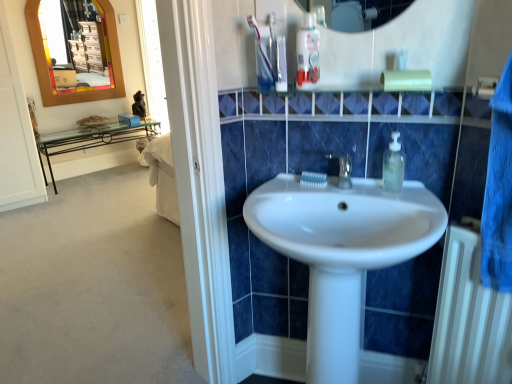
Question: Choose the correct answer: Is white metallic radiator at lower right inside white glossy toothpaste at upper center, which is the first toothpaste in left-to-right order, or outside it?

Choices:
 (A) outside
 (B) inside

Answer: (A)

Question: Is white metallic radiator at lower right taller or shorter than white glossy toothpaste at upper center, which is the 2th toothpaste from bottom to top?

Choices:
 (A) tall
 (B) short

Answer: (A)

Question: Which of these objects is positioned closest to the clear plastic soap dispenser at upper right?

Choices:
 (A) white metallic radiator at lower right
 (B) white glossy toothpaste at upper center, the first toothpaste in the top-to-bottom sequence
 (C) clear plastic mouthwash at upper center
 (D) white glossy toothpaste at center, the second toothpaste viewed from the left
 (E) wooden-framed mirror at upper left

Answer: (D)

Question: Based on their relative distances, which object is nearer to the wooden-framed mirror at upper left?

Choices:
 (A) white metallic radiator at lower right
 (B) clear plastic soap dispenser at upper right
 (C) white glossy toothpaste at center, acting as the first toothpaste starting from the back
 (D) clear plastic mouthwash at upper center
 (E) white glossy sink at center

Answer: (D)